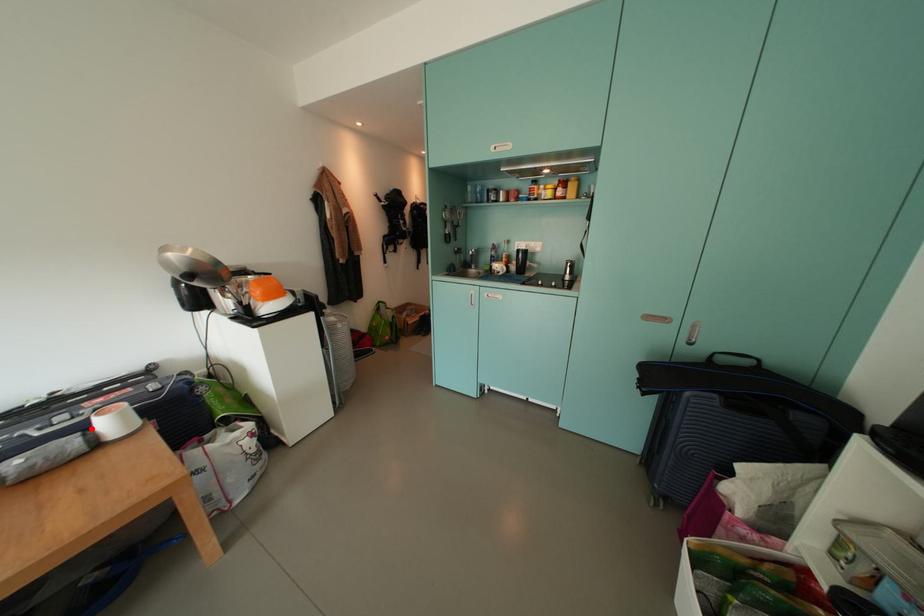
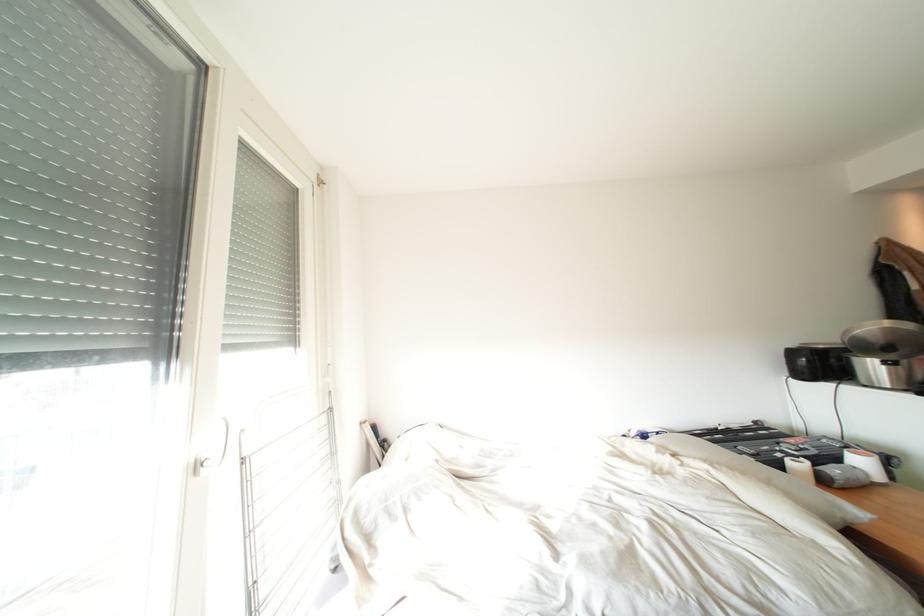
The point at the highlighted location is marked in the first image. Where is the corresponding point in the second image?

(845, 463)